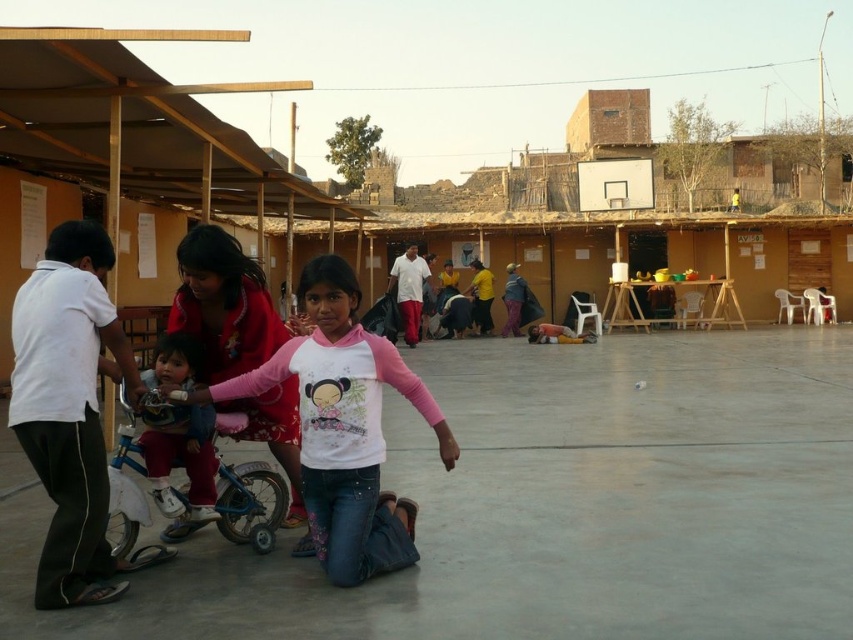
You are a photographer trying to capture a closeup of the pink fabric shirt at center. Based on the coordinates provided, where should you position your camera relative to the scene?

The pink fabric shirt at center is located at coordinates point 0.667 on the x axis and 0.403 on the y axis, so the camera should be positioned slightly to the right and lower center to capture the closeup.

You are a photographer trying to capture a photo of the pink fabric shirt at center and the blue plastic tricycle at center. Which object should you focus on first if you want to ensure both are in the frame without moving the camera?

The pink fabric shirt at center is much taller than the blue plastic tricycle at center, so you should focus on the pink fabric shirt at center first to ensure both are in the frame.

You are a photographer trying to capture a candid shot of the light pink fabric shirt at center and the blue plastic tricycle at center. Since you want to ensure both are in focus, you need to know their vertical positions. Can you tell me which one is lower in the image?

The blue plastic tricycle at center is located below the light pink fabric shirt at center, so the tricycle is lower in the image.